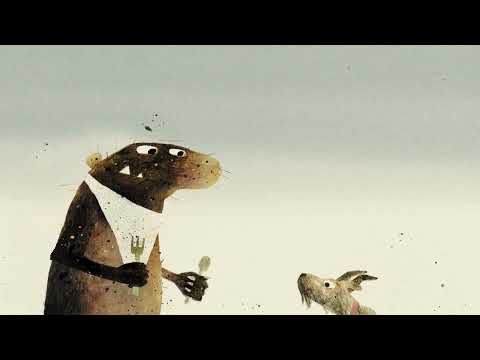
The image size is (480, 360). Identify the location of spoon. (204, 268).